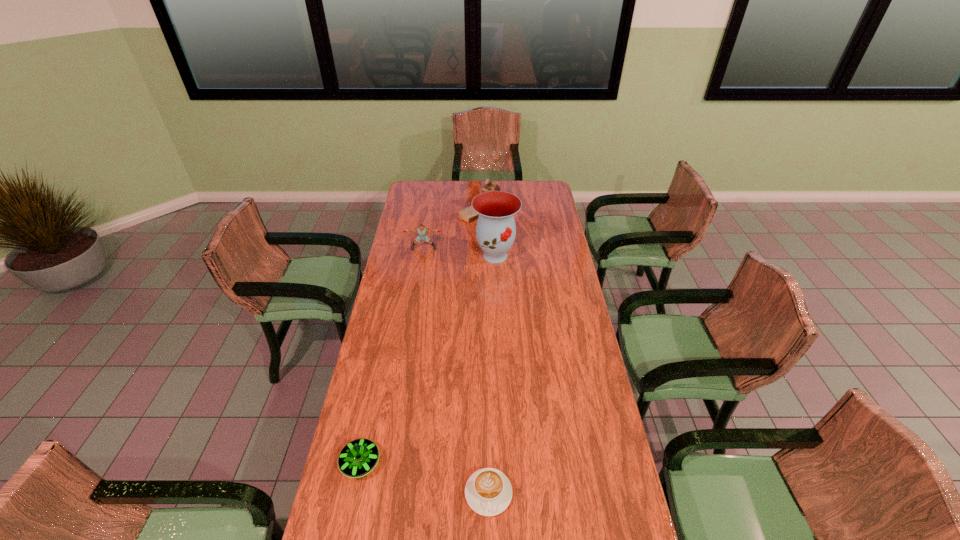
At what (x,y) coordinates should I click in order to perform the action: click on vase. Please return your answer as a coordinate pair (x, y). The height and width of the screenshot is (540, 960). Looking at the image, I should click on (495, 231).

Locate an element on the screen. The image size is (960, 540). the second tallest object is located at coordinates (468, 214).

The image size is (960, 540). I want to click on figurine, so [x=468, y=214].

Locate an element on the screen. The height and width of the screenshot is (540, 960). puncher is located at coordinates (422, 231).

Locate an element on the screen. This screenshot has height=540, width=960. saucer is located at coordinates (359, 457).

This screenshot has height=540, width=960. In order to click on cappuccino in this screenshot , I will do `click(488, 491)`.

This screenshot has height=540, width=960. I want to click on vacant space located on the front of the tallest object, so click(497, 313).

Identify the location of vacant space located on the front-facing side of the figurine. Image resolution: width=960 pixels, height=540 pixels. (433, 209).

Where is `free location located on the front-facing side of the figurine`? The width and height of the screenshot is (960, 540). free location located on the front-facing side of the figurine is located at coordinates (422, 209).

Locate an element on the screen. The image size is (960, 540). vacant space situated 0.300m on the front-facing side of the figurine is located at coordinates (404, 209).